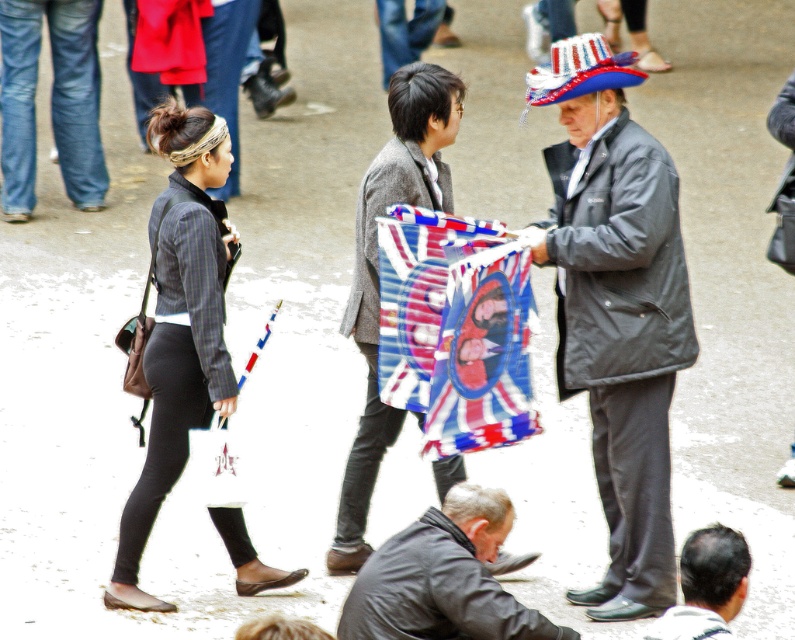
Based on the photo, which of these two, polyester flag at center or textured gray coat at center, stands shorter?

polyester flag at center is shorter.

Is point (404, 317) closer to viewer compared to point (366, 502)?

Yes.

Where is `polyester flag at center`? Image resolution: width=795 pixels, height=640 pixels. polyester flag at center is located at coordinates (456, 328).

Is point (167, 109) in front of point (479, 241)?

No, (167, 109) is behind (479, 241).

Is matte black leggings at center shorter than polyester flag at center?

Incorrect, matte black leggings at center's height does not fall short of polyester flag at center's.

Does point (157, 115) come behind point (522, 275)?

No, (157, 115) is in front of (522, 275).

The width and height of the screenshot is (795, 640). What are the coordinates of `matte black leggings at center` in the screenshot? It's located at (180, 324).

Can you confirm if gray fabric hat at right is wider than matte black leggings at center?

Correct, the width of gray fabric hat at right exceeds that of matte black leggings at center.

At what (x,y) coordinates should I click in order to perform the action: click on gray fabric hat at right. Please return your answer as a coordinate pair (x, y). This screenshot has height=640, width=795. Looking at the image, I should click on (619, 312).